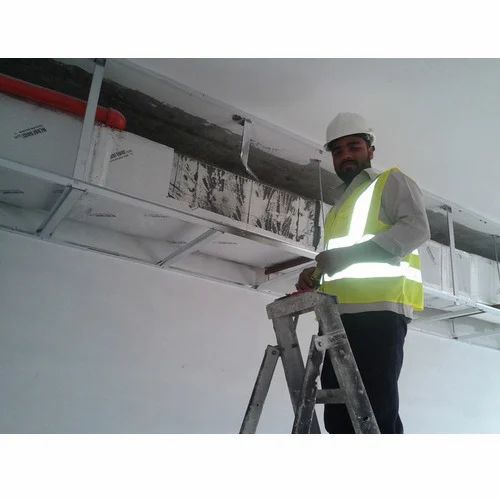
Identify the location of ventilation duct. This screenshot has height=500, width=500. (166, 227), (166, 474).